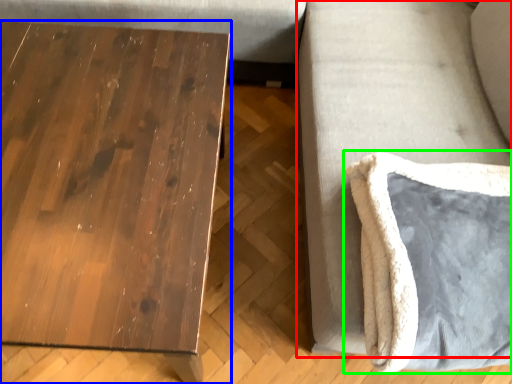
Question: Which is nearer to the couch (highlighted by a red box)? table (highlighted by a blue box) or swivel chair (highlighted by a green box).

Choices:
 (A) table
 (B) swivel chair

Answer: (B)